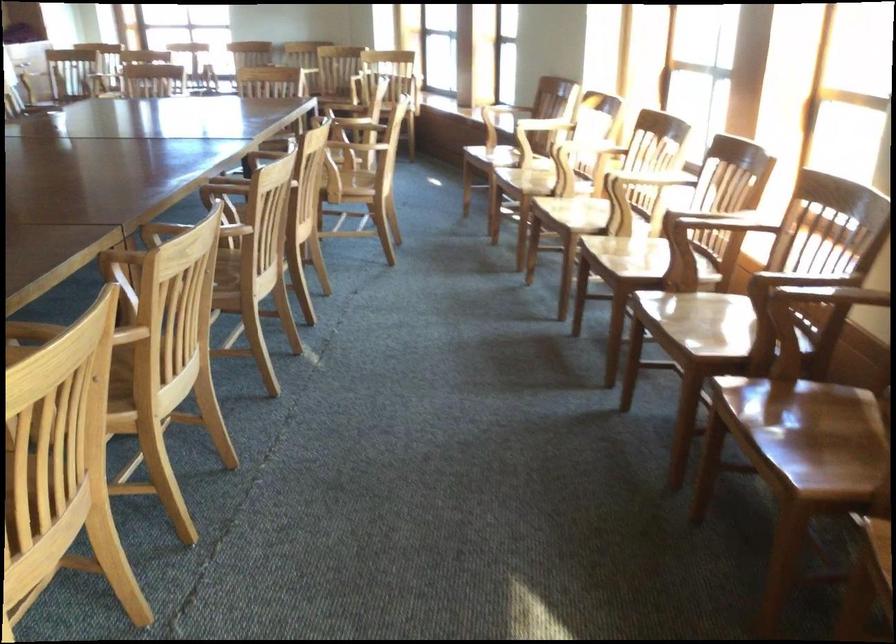
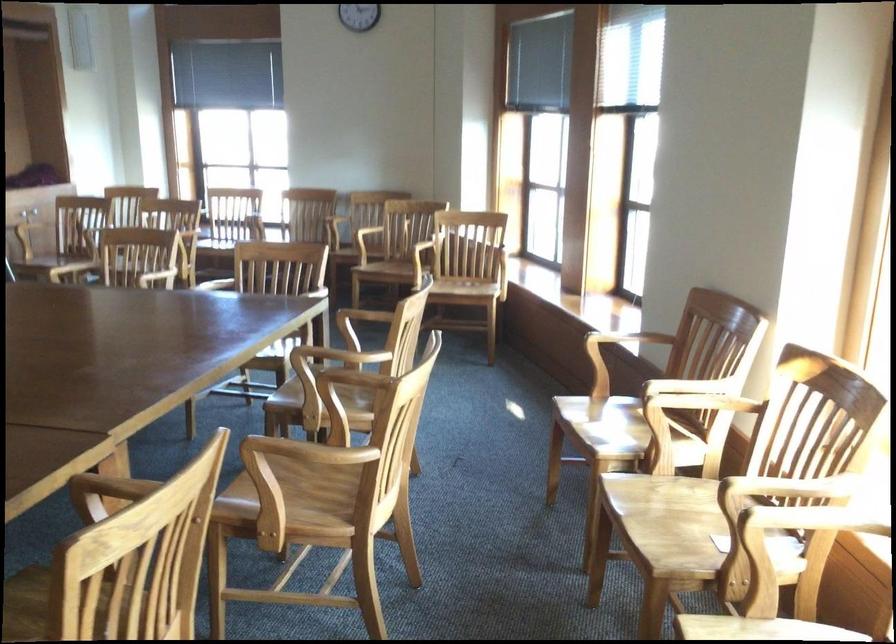
Locate, in the second image, the point that corresponds to (257,154) in the first image.

(108, 489)